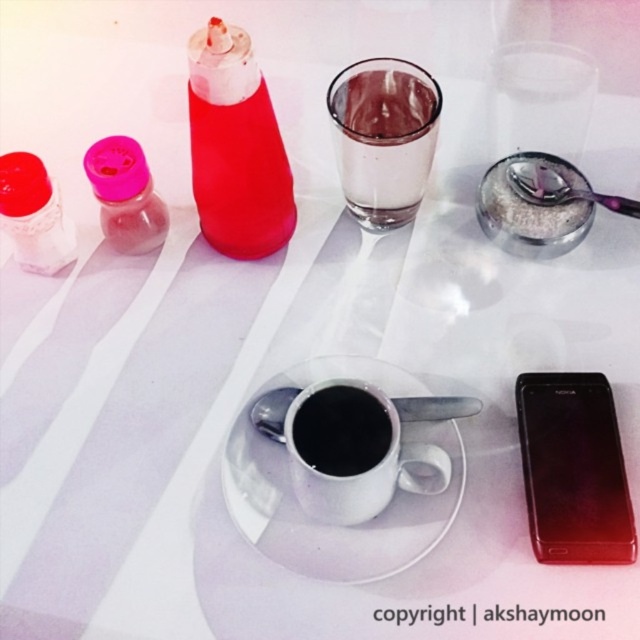
You are a customer at a cafe and want to place your smartphone on the table. The server tells you that there is a designated spot for smartphones at point (573, 468). Can you confirm if the black glossy smartphone at center right is currently placed at that location?

Yes, the point (573, 468) corresponds to the black glossy smartphone at center right, so it is placed at the designated spot.